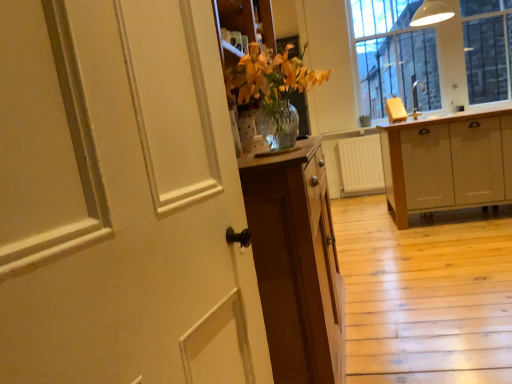
Question: Considering the relative sizes of light wood cabinet at right and white painted wood door at left in the image provided, is light wood cabinet at right bigger than white painted wood door at left?

Choices:
 (A) yes
 (B) no

Answer: (A)

Question: Considering the relative sizes of light wood cabinet at right and white painted wood door at left in the image provided, is light wood cabinet at right wider than white painted wood door at left?

Choices:
 (A) yes
 (B) no

Answer: (A)

Question: Is the depth of light wood cabinet at right greater than that of white painted wood door at left?

Choices:
 (A) no
 (B) yes

Answer: (B)

Question: Can you confirm if light wood cabinet at right is positioned to the left of white painted wood door at left?

Choices:
 (A) yes
 (B) no

Answer: (B)

Question: From the image's perspective, does light wood cabinet at right appear higher than white painted wood door at left?

Choices:
 (A) yes
 (B) no

Answer: (A)

Question: From a real-world perspective, does light wood cabinet at right sit lower than white painted wood door at left?

Choices:
 (A) yes
 (B) no

Answer: (A)

Question: Does light wood cabinet at right have a greater width compared to matte silver faucet at upper right?

Choices:
 (A) no
 (B) yes

Answer: (B)

Question: Considering the relative sizes of light wood cabinet at right and matte silver faucet at upper right in the image provided, is light wood cabinet at right taller than matte silver faucet at upper right?

Choices:
 (A) no
 (B) yes

Answer: (B)

Question: Is light wood cabinet at right positioned before matte silver faucet at upper right?

Choices:
 (A) yes
 (B) no

Answer: (A)

Question: Is the surface of light wood cabinet at right in direct contact with matte silver faucet at upper right?

Choices:
 (A) yes
 (B) no

Answer: (B)

Question: Considering the relative sizes of light wood cabinet at right and matte silver faucet at upper right in the image provided, is light wood cabinet at right shorter than matte silver faucet at upper right?

Choices:
 (A) no
 (B) yes

Answer: (A)

Question: Does light wood cabinet at right appear on the left side of matte silver faucet at upper right?

Choices:
 (A) no
 (B) yes

Answer: (A)

Question: Is light wood cabinet at right facing towards clear glass window at upper right?

Choices:
 (A) yes
 (B) no

Answer: (B)